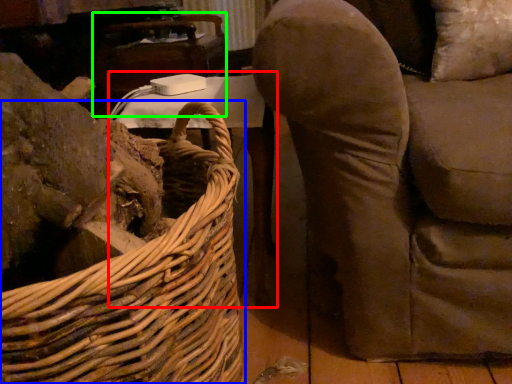
Question: Estimate the real-world distances between objects in this image. Which object is farther from table (highlighted by a red box), picnic basket (highlighted by a blue box) or table (highlighted by a green box)?

Choices:
 (A) picnic basket
 (B) table

Answer: (B)